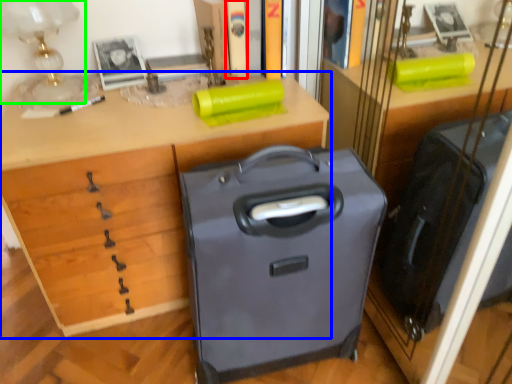
Question: Which object is positioned closest to book (highlighted by a red box)? Select from desk (highlighted by a blue box) and table lamp (highlighted by a green box).

Choices:
 (A) desk
 (B) table lamp

Answer: (B)